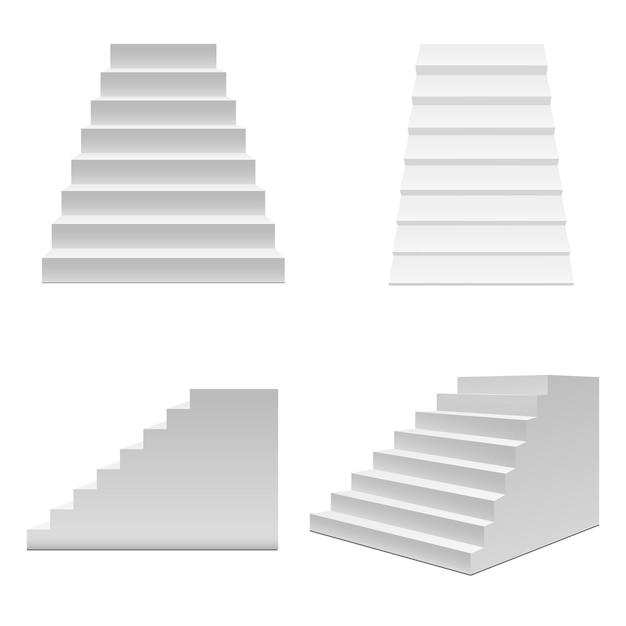
I want to click on staircase, so click(187, 491), click(544, 488), click(182, 165), click(476, 146).